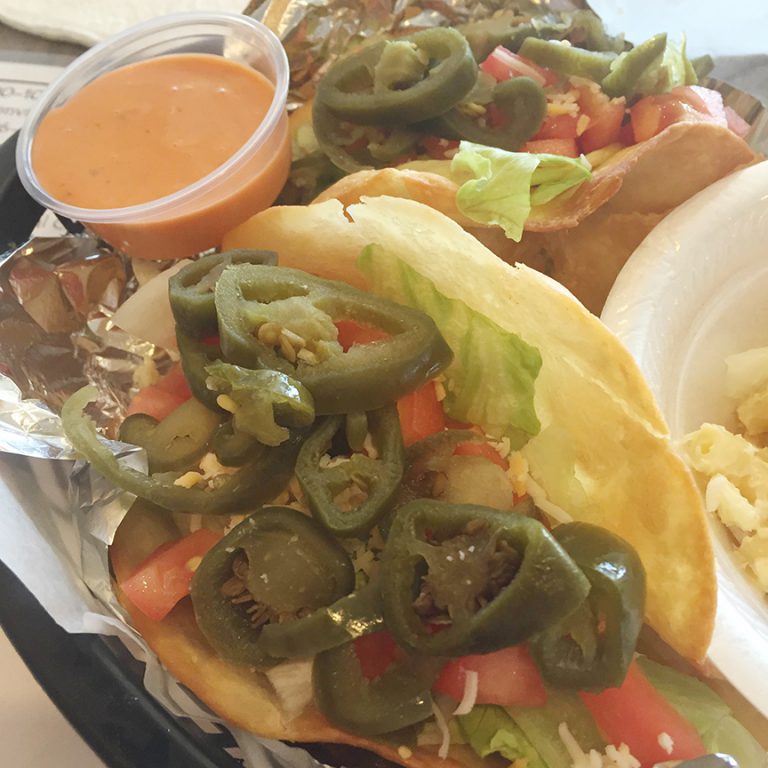
Find the location of `bowl`. bowl is located at coordinates (687, 293).